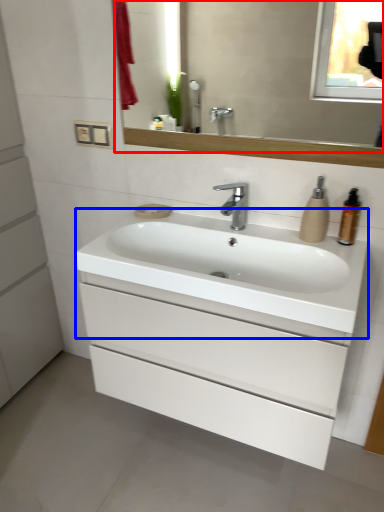
Question: Which object appears closest to the camera in this image, mirror (highlighted by a red box) or counter top (highlighted by a blue box)?

Choices:
 (A) mirror
 (B) counter top

Answer: (B)